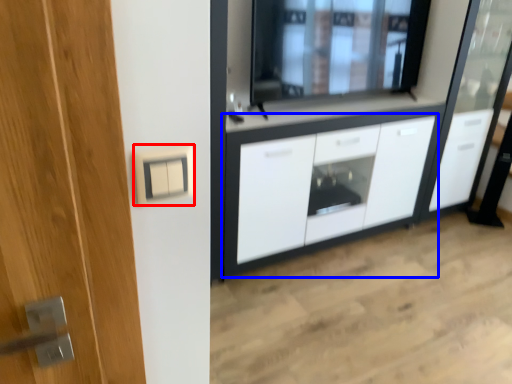
Question: Among these objects, which one is nearest to the camera, electric outlet (highlighted by a red box) or cabinetry (highlighted by a blue box)?

Choices:
 (A) electric outlet
 (B) cabinetry

Answer: (A)